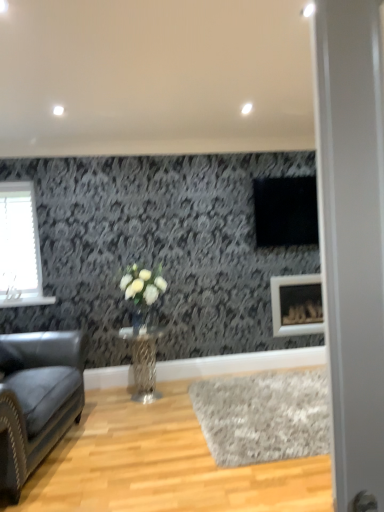
Identify the location of white matte vase at center. (142, 292).

The height and width of the screenshot is (512, 384). Describe the element at coordinates (143, 361) in the screenshot. I see `metallic textured table at center` at that location.

The image size is (384, 512). What do you see at coordinates (38, 400) in the screenshot?
I see `leather couch at left` at bounding box center [38, 400].

Image resolution: width=384 pixels, height=512 pixels. I want to click on transparent glass door at right, so click(352, 238).

In order to face white matte picture frame at lower right, should I rotate leftwards or rightwards?

You should rotate right by 13.766 degrees.

The height and width of the screenshot is (512, 384). In order to click on white matte picture frame at lower right in this screenshot , I will do pyautogui.click(x=296, y=305).

Find the location of a particular element. clear glass vase at center is located at coordinates (139, 321).

The height and width of the screenshot is (512, 384). I want to click on white matte vase at center, so click(142, 292).

Is point (144, 323) in front of point (297, 390)?

No, it is not.

In terms of width, does clear glass vase at center look wider or thinner when compared to gray shag rug at lower center?

clear glass vase at center is thinner than gray shag rug at lower center.

Identify the location of glass vase above the gray shag rug at lower center (from the image's perspective). This screenshot has height=512, width=384. (139, 321).

Looking at this image, between clear glass vase at center and gray shag rug at lower center, which one is positioned in front?

gray shag rug at lower center is more forward.

Is metallic textured table at center situated inside transparent glass door at right or outside?

metallic textured table at center is not inside transparent glass door at right, it's outside.

What are the coordinates of `table behind the transparent glass door at right` in the screenshot? It's located at (143, 361).

Between metallic textured table at center and transparent glass door at right, which one is positioned behind?

metallic textured table at center is more distant.

Is metallic textured table at center wider than transparent glass door at right?

Yes, metallic textured table at center is wider than transparent glass door at right.

From a real-world perspective, is white matte picture frame at lower right on top of transparent glass door at right?

No, from a real-world perspective, white matte picture frame at lower right is not above transparent glass door at right.

Is point (278, 314) closer to camera compared to point (317, 69)?

No.

Is white matte picture frame at lower right in contact with transparent glass door at right?

No, white matte picture frame at lower right is not touching transparent glass door at right.

Considering the positions of points (164, 286) and (374, 130), is point (164, 286) farther from camera compared to point (374, 130)?

Yes, it is.

Is white matte vase at center with transparent glass door at right?

There is a gap between white matte vase at center and transparent glass door at right.

The width and height of the screenshot is (384, 512). I want to click on floral arrangement that appears on the left of transparent glass door at right, so click(x=142, y=292).

Is transparent glass door at right at the back of white matte vase at center?

white matte vase at center is not turned away from transparent glass door at right.

Does clear glass vase at center lie in front of white matte vase at center?

That is False.

Considering the relative sizes of clear glass vase at center and white matte vase at center in the image provided, is clear glass vase at center shorter than white matte vase at center?

Indeed, clear glass vase at center has a lesser height compared to white matte vase at center.

Between clear glass vase at center and white matte vase at center, which one appears on the left side from the viewer's perspective?

Positioned to the left is clear glass vase at center.

From the image's perspective, is clear glass vase at center located above or below white matte vase at center?

clear glass vase at center is below white matte vase at center.

From a real-world perspective, does white matte picture frame at lower right sit lower than leather couch at left?

No, from a real-world perspective, white matte picture frame at lower right is not below leather couch at left.

From the picture: Does white matte picture frame at lower right contain leather couch at left?

No, white matte picture frame at lower right does not contain leather couch at left.

Is point (293, 286) positioned in front of point (39, 455)?

No, it is not.

Considering the sizes of objects transparent glass door at right and gray shag rug at lower center in the image provided, who is bigger, transparent glass door at right or gray shag rug at lower center?

With larger size is gray shag rug at lower center.

Does transparent glass door at right have a greater width compared to gray shag rug at lower center?

No, transparent glass door at right is not wider than gray shag rug at lower center.

Locate an element on the screen. This screenshot has height=512, width=384. plain located behind the transparent glass door at right is located at coordinates (263, 416).

From the picture: From a real-world perspective, who is located lower, transparent glass door at right or gray shag rug at lower center?

gray shag rug at lower center is physically lower.

Identify the location of glass vase above the gray shag rug at lower center (from the image's perspective). Image resolution: width=384 pixels, height=512 pixels. (139, 321).

Identify the location of table that appears behind the transparent glass door at right. The height and width of the screenshot is (512, 384). (143, 361).

Which object lies nearer to the anchor point metallic textured table at center, white matte vase at center or clear glass vase at center?

The object closer to metallic textured table at center is clear glass vase at center.

Considering their positions, is leather couch at left positioned further to white matte vase at center than white matte picture frame at lower right?

Based on the image, white matte picture frame at lower right appears to be further to white matte vase at center.

When comparing their distances from clear glass vase at center, does metallic textured table at center or gray shag rug at lower center seem closer?

metallic textured table at center.

From the image, which object appears to be nearer to clear glass vase at center, leather couch at left or transparent glass door at right?

leather couch at left lies closer to clear glass vase at center than the other object.

Which object lies further to the anchor point white matte vase at center, white matte picture frame at lower right or leather couch at left?

white matte picture frame at lower right lies further to white matte vase at center than the other object.

Estimate the real-world distances between objects in this image. Which object is further from gray shag rug at lower center, metallic textured table at center or clear glass vase at center?

clear glass vase at center is positioned further to the anchor gray shag rug at lower center.

Estimate the real-world distances between objects in this image. Which object is closer to gray shag rug at lower center, metallic textured table at center or white matte picture frame at lower right?

The object closer to gray shag rug at lower center is metallic textured table at center.

Considering their positions, is clear glass vase at center positioned closer to metallic textured table at center than leather couch at left?

clear glass vase at center.

The height and width of the screenshot is (512, 384). I want to click on table situated between leather couch at left and white matte picture frame at lower right from left to right, so click(x=143, y=361).

Identify the location of table positioned between transparent glass door at right and clear glass vase at center from near to far. This screenshot has width=384, height=512. (143, 361).

Locate an element on the screen. This screenshot has width=384, height=512. studio couch between transparent glass door at right and clear glass vase at center from front to back is located at coordinates (38, 400).

You are a GUI agent. You are given a task and a screenshot of the screen. Output one action in this format:
    pyautogui.click(x=<x>, y=<y>)
    Task: Click on the plain between transparent glass door at right and white matte picture frame at lower right in the front-back direction
    Image resolution: width=384 pixels, height=512 pixels.
    Given the screenshot: What is the action you would take?
    pyautogui.click(x=263, y=416)